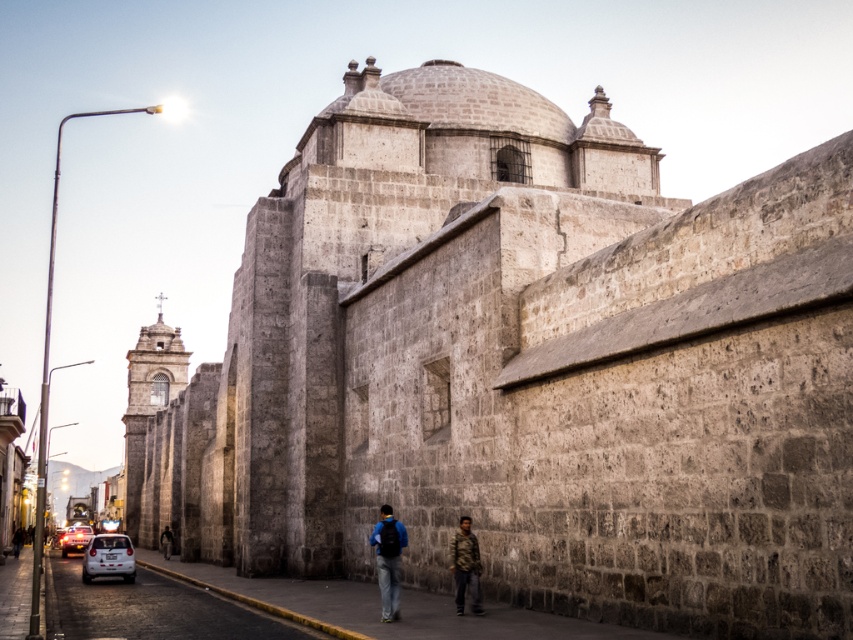
Question: Can you confirm if white stone car at lower left is positioned below white plastic car at lower left?

Choices:
 (A) yes
 (B) no

Answer: (B)

Question: Does blue fabric backpack at center appear on the left side of camouflage jacket at lower right?

Choices:
 (A) yes
 (B) no

Answer: (A)

Question: Which object is the closest to the white matte car at lower left?

Choices:
 (A) camouflage jacket at lower right
 (B) white stone car at lower left

Answer: (B)

Question: Which of the following is the farthest from the observer?

Choices:
 (A) camouflage jacket at lower right
 (B) white stone car at lower left

Answer: (A)

Question: From the image, what is the correct spatial relationship of white stone car at lower left in relation to camouflage jacket at lower right?

Choices:
 (A) right
 (B) left

Answer: (B)

Question: Which point is farther to the camera?

Choices:
 (A) (463, 570)
 (B) (384, 580)
 (C) (90, 557)
 (D) (113, 604)

Answer: (C)